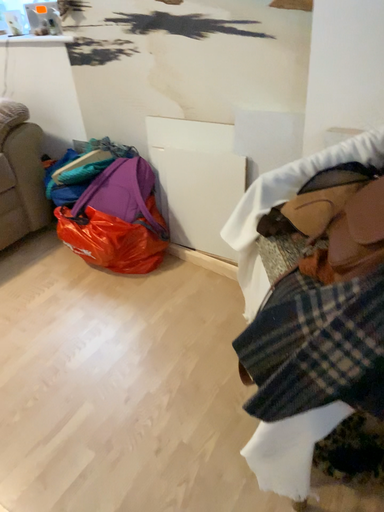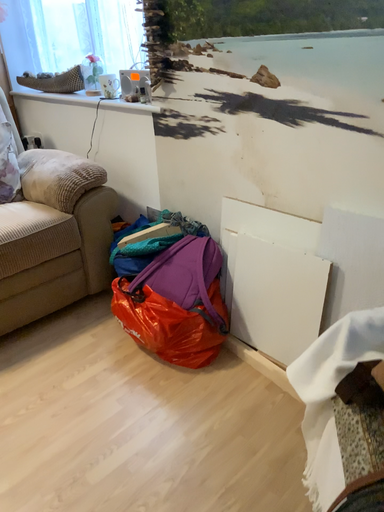
Question: Which way did the camera rotate in the video?

Choices:
 (A) rotated upward
 (B) rotated downward

Answer: (A)